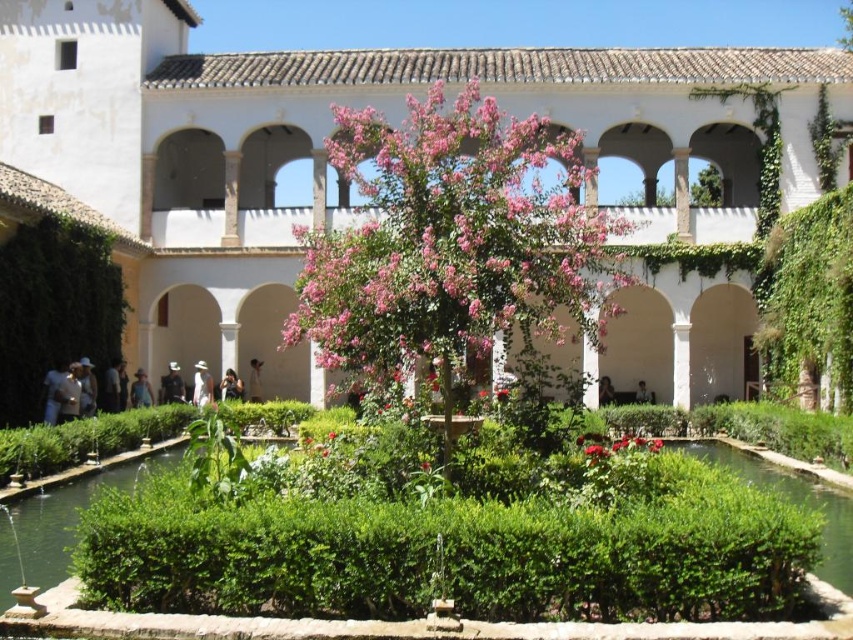
Question: Is dark brown leather jacket at lower left wider than white fabric at center?

Choices:
 (A) no
 (B) yes

Answer: (B)

Question: Which is nearer to the pink flowering tree at center?

Choices:
 (A) white stucco palace at center
 (B) dark brown leather jacket at center

Answer: (A)

Question: Is white cotton shirt at lower left wider than denim jacket at center?

Choices:
 (A) no
 (B) yes

Answer: (B)

Question: Which of these objects is positioned closest to the light brown leather hat at lower left?

Choices:
 (A) dark brown leather jacket at center
 (B) matte black camera at center
 (C) dark gray fabric at center

Answer: (C)

Question: Which object is closer to the camera taking this photo?

Choices:
 (A) matte black camera at center
 (B) dark brown leather jacket at center

Answer: (A)

Question: Considering the relative positions of green leafy pond at lower right and dark brown leather jacket at lower left in the image provided, where is green leafy pond at lower right located with respect to dark brown leather jacket at lower left?

Choices:
 (A) right
 (B) left

Answer: (A)